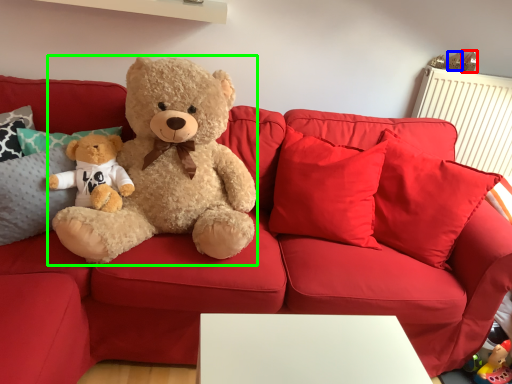
Question: Which object is the farthest from toy (highlighted by a red box)? Choose among these: toy (highlighted by a blue box) or teddy bear (highlighted by a green box).

Choices:
 (A) toy
 (B) teddy bear

Answer: (B)